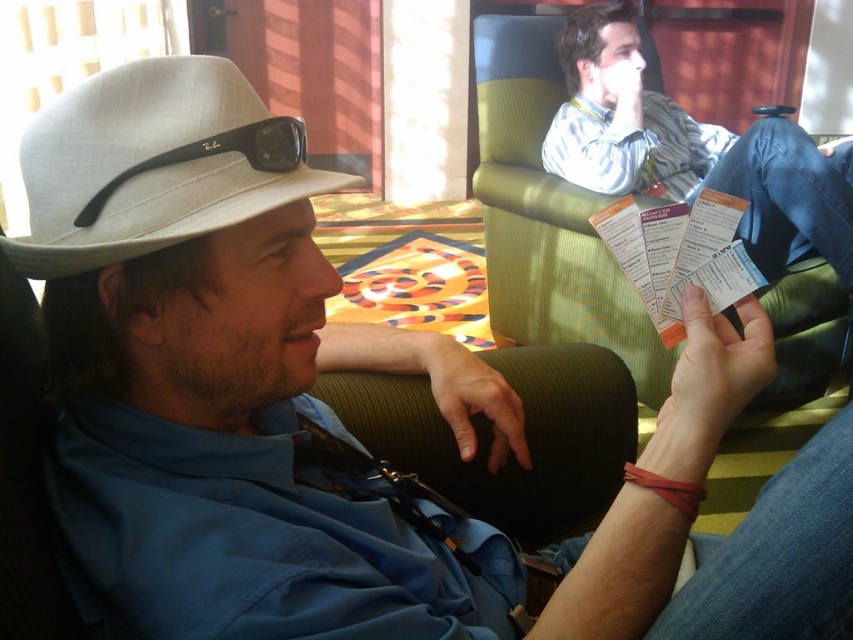
You are standing in the lounge area and want to locate the point at coordinates [154,163]. Which object is this point located on?

The point at coordinates [154,163] is located on the white fabric fedora at left.

You are a photographer standing 20 inches away from a subject. You want to take a closeup photo of the white fabric fedora at left without moving the subject. Is the current distance sufficient to capture the fedora in focus?

The white fabric fedora at left is 17.63 inches away from the viewer. Since the photographer is standing 20 inches away, which is slightly farther than the fedora, the distance is sufficient to capture the fedora in focus as it falls within the photographer and subject distance range.

You are standing in the lounge area and need to locate the white fabric fedora at left. According to the coordinates provided, where exactly is it positioned?

The white fabric fedora at left is positioned at coordinates point (154, 163).